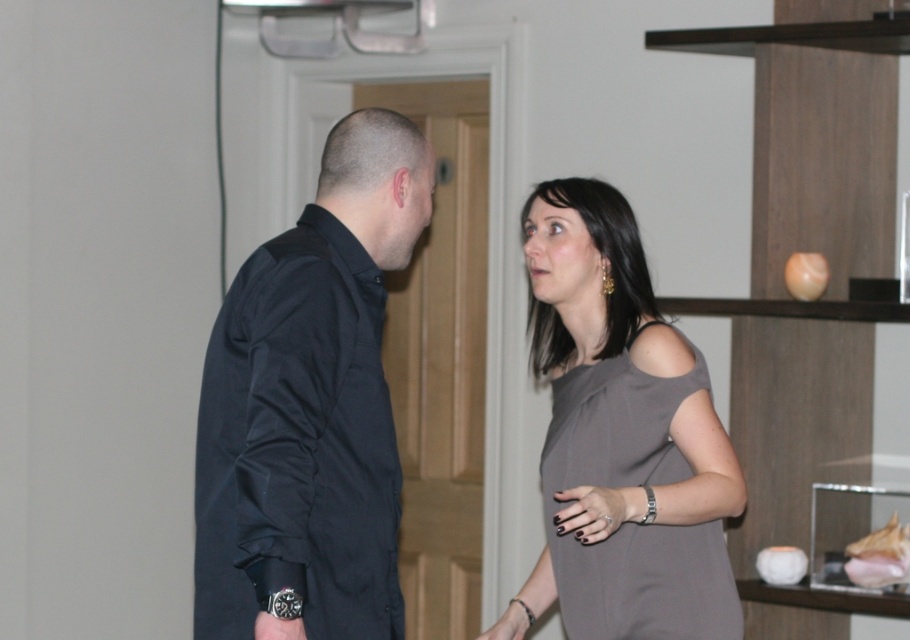
You are a photographer setting up for a portrait. You have a camera with a 1.5 meter wide frame. You need to position both the black matte shirt at left and the gray matte dress at center within the frame. Can both fit side by side horizontally?

The black matte shirt at left might be wider than gray matte dress at center, so it is uncertain if both can fit side by side within the 1.5 meter frame. Measure their combined width to confirm.

You are a photographer trying to capture a closeup of both the black matte shirt at left and the gray matte dress at center. Since the camera can only focus on one object at a time, which object should you focus on first to ensure the larger one is in focus?

The black matte shirt at left is larger in size than the gray matte dress at center, so you should focus on the black matte shirt at left first to ensure it is in focus.